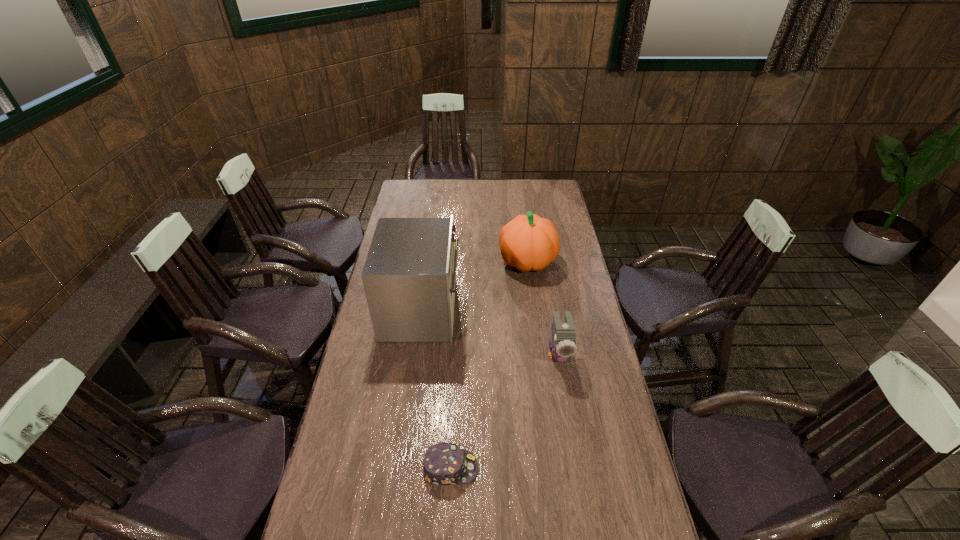
This screenshot has width=960, height=540. Find the location of `free space between the tallest object and the bird`. free space between the tallest object and the bird is located at coordinates tap(490, 332).

Where is `unoccupied position between the shortest object and the farthest object`? unoccupied position between the shortest object and the farthest object is located at coordinates (489, 365).

You are a GUI agent. You are given a task and a screenshot of the screen. Output one action in this format:
    pyautogui.click(x=<x>, y=<y>)
    Task: Click on the vacant space that is in between the tallest object and the nearest object
    Image resolution: width=960 pixels, height=540 pixels.
    Given the screenshot: What is the action you would take?
    pyautogui.click(x=436, y=389)

Identify the location of free space between the third tallest object and the nearest object. (504, 411).

Where is `vacant region between the third shortest object and the tallest object`? This screenshot has height=540, width=960. vacant region between the third shortest object and the tallest object is located at coordinates (474, 286).

Find the location of a particular element. This screenshot has width=960, height=540. vacant point located between the farthest object and the toaster oven is located at coordinates (474, 286).

Locate an element on the screen. The width and height of the screenshot is (960, 540). vacant area between the second shortest object and the tallest object is located at coordinates (490, 332).

Image resolution: width=960 pixels, height=540 pixels. In order to click on free spot between the farthest object and the second shortest object in this screenshot , I will do `click(543, 308)`.

Where is `object that is the third closest to the nearest object`? object that is the third closest to the nearest object is located at coordinates (528, 242).

Select which object appears as the second closest to the pumpkin. Please provide its 2D coordinates. Your answer should be formatted as a tuple, i.e. [(x, y)], where the tuple contains the x and y coordinates of a point satisfying the conditions above.

[(563, 345)]